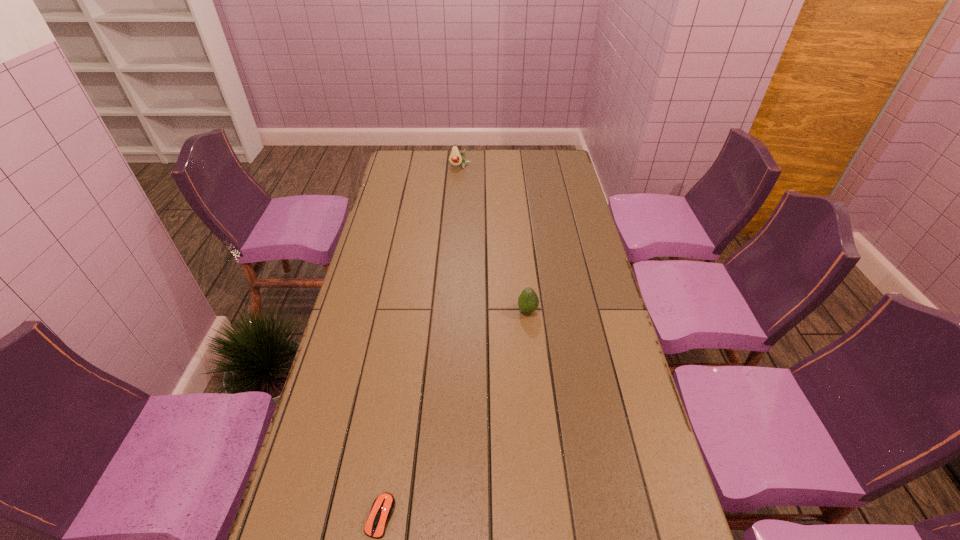
Image resolution: width=960 pixels, height=540 pixels. Identify the location of free location at the far edge. (517, 153).

The width and height of the screenshot is (960, 540). In the image, there is a desktop. In order to click on free space at the left edge in this screenshot , I will do `click(367, 447)`.

In the image, there is a desktop. Where is `free space at the right edge`? This screenshot has height=540, width=960. free space at the right edge is located at coordinates [548, 218].

In order to click on vacant space that's between the second farthest object and the left avocado in this screenshot , I will do `click(493, 239)`.

I want to click on vacant area between the leftmost object and the second nearest object, so coord(454,414).

Image resolution: width=960 pixels, height=540 pixels. What are the coordinates of `unoccupied area between the right avocado and the second object from right to left` in the screenshot? It's located at (493, 239).

What are the coordinates of `unoccupied position between the farther avocado and the shortest object` in the screenshot? It's located at (420, 341).

The image size is (960, 540). I want to click on free space between the second object from right to left and the right avocado, so click(493, 239).

You are a GUI agent. You are given a task and a screenshot of the screen. Output one action in this format:
    pyautogui.click(x=<x>, y=<y>)
    Task: Click on the empty space between the right avocado and the second object from left to right
    This screenshot has width=960, height=540.
    Given the screenshot: What is the action you would take?
    pyautogui.click(x=493, y=239)

This screenshot has width=960, height=540. Find the location of `vacant area that lies between the computer mouse and the left avocado`. vacant area that lies between the computer mouse and the left avocado is located at coordinates (420, 341).